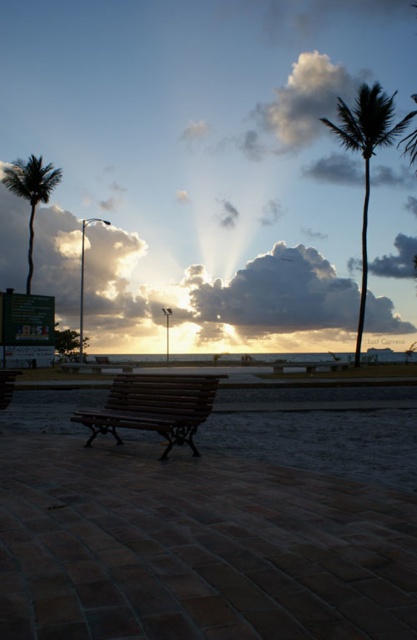
Question: Which point appears farthest from the camera in this image?

Choices:
 (A) (266, 106)
 (B) (353, 296)
 (C) (97, 426)

Answer: (A)

Question: Can you confirm if white fluffy cloud at upper center is positioned to the left of green leafy palm tree at left?

Choices:
 (A) no
 (B) yes

Answer: (A)

Question: Is green leafy palm tree at right positioned at the back of wooden bench at lower left?

Choices:
 (A) no
 (B) yes

Answer: (B)

Question: Among these points, which one is farthest from the camera?

Choices:
 (A) (42, 173)
 (B) (185, 376)
 (C) (246, 268)

Answer: (C)

Question: Which of these objects is positioned farthest from the wooden bench at lower left?

Choices:
 (A) wooden bench at center
 (B) green leafy palm tree at left

Answer: (B)

Question: Can you confirm if wooden bench at center is thinner than green leafy palm tree at left?

Choices:
 (A) no
 (B) yes

Answer: (B)